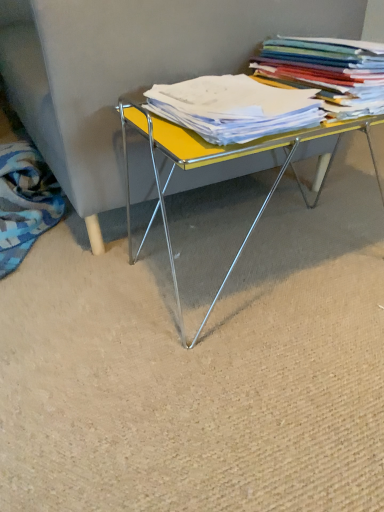
Question: Looking at their shapes, would you say multicolored paper stack at upper right is wider or thinner than yellow matte paper at center?

Choices:
 (A) wide
 (B) thin

Answer: (A)

Question: Considering the positions of multicolored paper stack at upper right and yellow matte paper at center in the image, is multicolored paper stack at upper right bigger or smaller than yellow matte paper at center?

Choices:
 (A) small
 (B) big

Answer: (B)

Question: Estimate the real-world distances between objects in this image. Which object is closer to the yellow matte paper at center?

Choices:
 (A) multicolored paper stack at upper right
 (B) yellow glossy table at center
 (C) blue patterned fabric at lower left

Answer: (A)

Question: Which is farther from the blue patterned fabric at lower left?

Choices:
 (A) multicolored paper stack at upper right
 (B) yellow matte paper at center
 (C) yellow glossy table at center

Answer: (A)